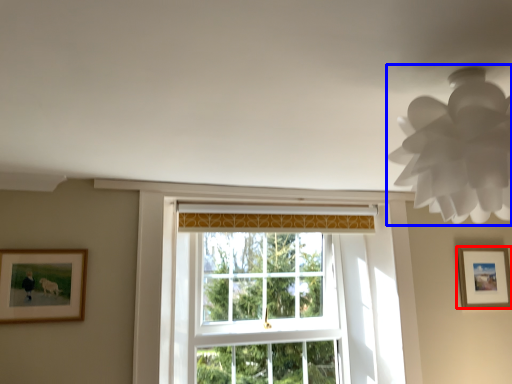
Question: Which point is further to the camera, picture frame (highlighted by a red box) or lamp (highlighted by a blue box)?

Choices:
 (A) picture frame
 (B) lamp

Answer: (A)